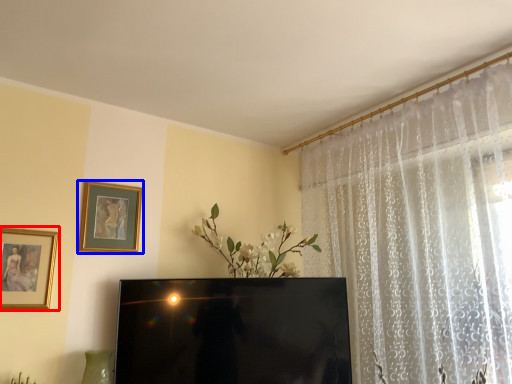
Question: Which object appears closest to the camera in this image, picture frame (highlighted by a red box) or picture frame (highlighted by a blue box)?

Choices:
 (A) picture frame
 (B) picture frame

Answer: (A)